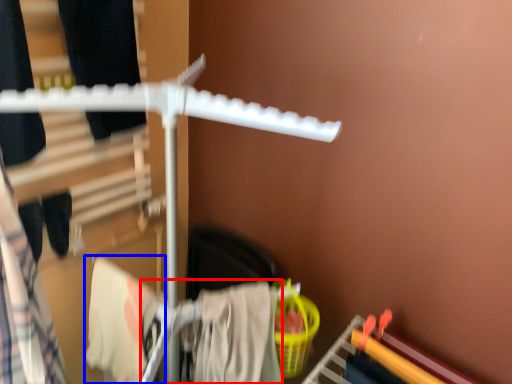
Question: Which object appears closest to the camera in this image, clothing (highlighted by a red box) or clothing (highlighted by a blue box)?

Choices:
 (A) clothing
 (B) clothing

Answer: (A)